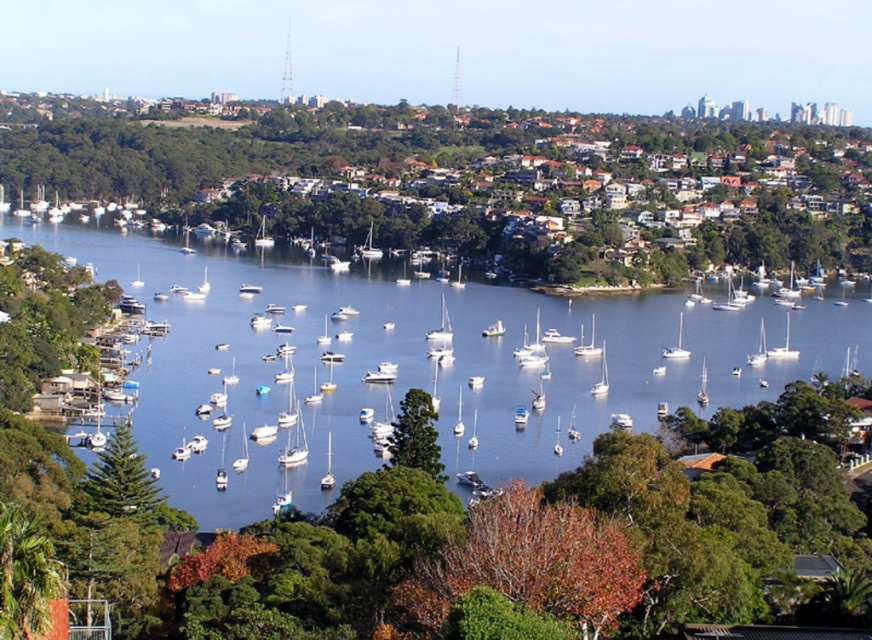
You are standing at the point closest to you in the image. There are two points marked in the scene, one at coordinates point (671,298) and another at point (675,349). Which of these points is farther away from your current position?

Point (671,298) is behind point (675,349), so the point at (671,298) is farther away from your current position.

You are a photographer planning to take a photo of the waterfront scene. You want to ensure both the green leafy tree at center and the white matte sailboat at center are clearly visible in your shot. Considering their sizes, which object should you focus on first to ensure proper framing?

The green leafy tree at center is much taller than the white matte sailboat at center, so you should focus on the green leafy tree at center first to ensure it fits within the frame properly.